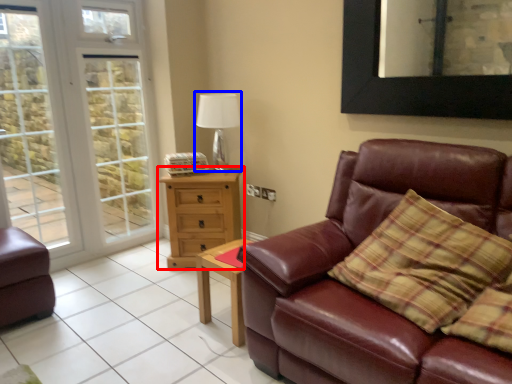
Question: Which point is closer to the camera, chest of drawers (highlighted by a red box) or table lamp (highlighted by a blue box)?

Choices:
 (A) chest of drawers
 (B) table lamp

Answer: (A)